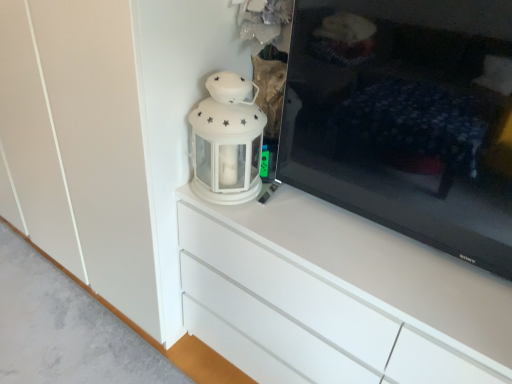
At what (x,y) coordinates should I click in order to perform the action: click on vacant point above white glossy chest of drawers at center (from a real-world perspective). Please return your answer as a coordinate pair (x, y). The height and width of the screenshot is (384, 512). Looking at the image, I should click on (375, 252).